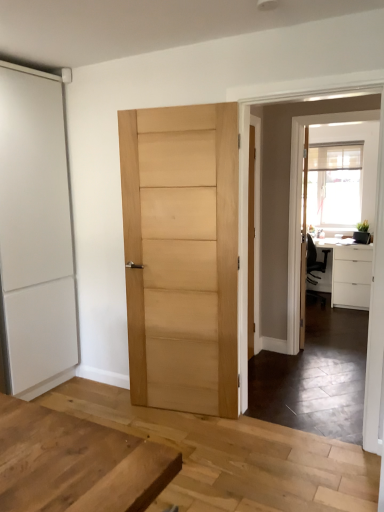
Question: Is natural wood door at center, which is the first door in right-to-left order, positioned with its back to clear glass screen door at upper right?

Choices:
 (A) no
 (B) yes

Answer: (A)

Question: Is natural wood door at center, the second door from the left, thinner than clear glass screen door at upper right?

Choices:
 (A) no
 (B) yes

Answer: (A)

Question: Does natural wood door at center, which is the first door in right-to-left order, have a larger size compared to clear glass screen door at upper right?

Choices:
 (A) no
 (B) yes

Answer: (B)

Question: Would you say natural wood door at center, which is the first door in right-to-left order, contains clear glass screen door at upper right?

Choices:
 (A) no
 (B) yes

Answer: (A)

Question: Is natural wood door at center, the second door from the left, at the left side of clear glass screen door at upper right?

Choices:
 (A) no
 (B) yes

Answer: (B)

Question: Considering the relative positions of natural wood door at center, which is the first door in right-to-left order, and clear glass screen door at upper right in the image provided, is natural wood door at center, which is the first door in right-to-left order, to the right of clear glass screen door at upper right from the viewer's perspective?

Choices:
 (A) no
 (B) yes

Answer: (A)

Question: From a real-world perspective, does white matte cabinet at right stand above white matte sliding door at left, which ranks as the second door in right-to-left order?

Choices:
 (A) no
 (B) yes

Answer: (A)

Question: Considering the relative positions of white matte cabinet at right and white matte sliding door at left, which ranks as the second door in right-to-left order, in the image provided, is white matte cabinet at right to the right of white matte sliding door at left, which ranks as the second door in right-to-left order, from the viewer's perspective?

Choices:
 (A) no
 (B) yes

Answer: (B)

Question: Is white matte cabinet at right beside white matte sliding door at left, which ranks as the second door in right-to-left order?

Choices:
 (A) no
 (B) yes

Answer: (A)

Question: Does white matte cabinet at right have a larger size compared to white matte sliding door at left, placed as the first door when sorted from left to right?

Choices:
 (A) no
 (B) yes

Answer: (A)

Question: Is white matte cabinet at right taller than white matte sliding door at left, placed as the first door when sorted from left to right?

Choices:
 (A) no
 (B) yes

Answer: (A)

Question: Is white matte cabinet at right turned away from white matte sliding door at left, which ranks as the second door in right-to-left order?

Choices:
 (A) no
 (B) yes

Answer: (A)

Question: Is clear glass screen door at upper right further to the viewer compared to natural wood door at center, which is the first door in right-to-left order?

Choices:
 (A) no
 (B) yes

Answer: (B)